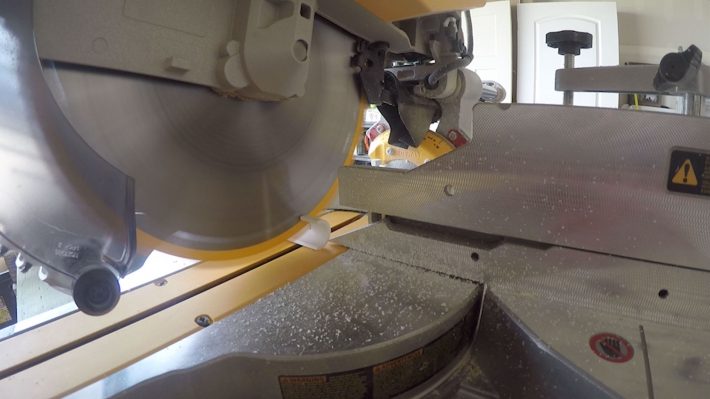
Where is `crown moulding`? crown moulding is located at coordinates (650, 50), (432, 309).